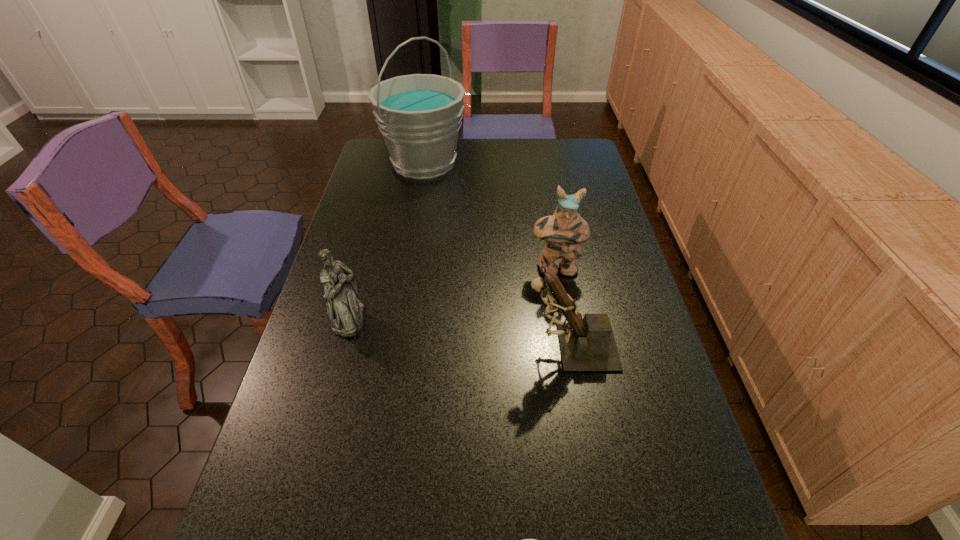
Where is `figurine that is the second closest to the fourth nearest object`? The image size is (960, 540). figurine that is the second closest to the fourth nearest object is located at coordinates (344, 309).

Choose which figurine is the nearest neighbor to the bucket. Please provide its 2D coordinates. Your answer should be formatted as a tuple, i.e. [(x, y)], where the tuple contains the x and y coordinates of a point satisfying the conditions above.

[(564, 231)]

Image resolution: width=960 pixels, height=540 pixels. In order to click on free spot that satisfies the following two spatial constraints: 1. on the front-facing side of the farthest figurine; 2. on the front-facing side of the shortest figurine in this screenshot , I will do `click(564, 319)`.

At what (x,y) coordinates should I click in order to perform the action: click on vacant space that satisfies the following two spatial constraints: 1. on the front-facing side of the second farthest object; 2. on the front-facing side of the fourth tallest object. Please return your answer as a coordinate pair (x, y). The image size is (960, 540). Looking at the image, I should click on (564, 319).